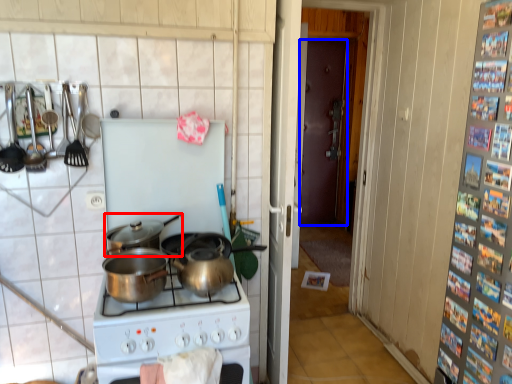
Question: Among these objects, which one is farthest to the camera, kitchen appliance (highlighted by a red box) or door (highlighted by a blue box)?

Choices:
 (A) kitchen appliance
 (B) door

Answer: (B)